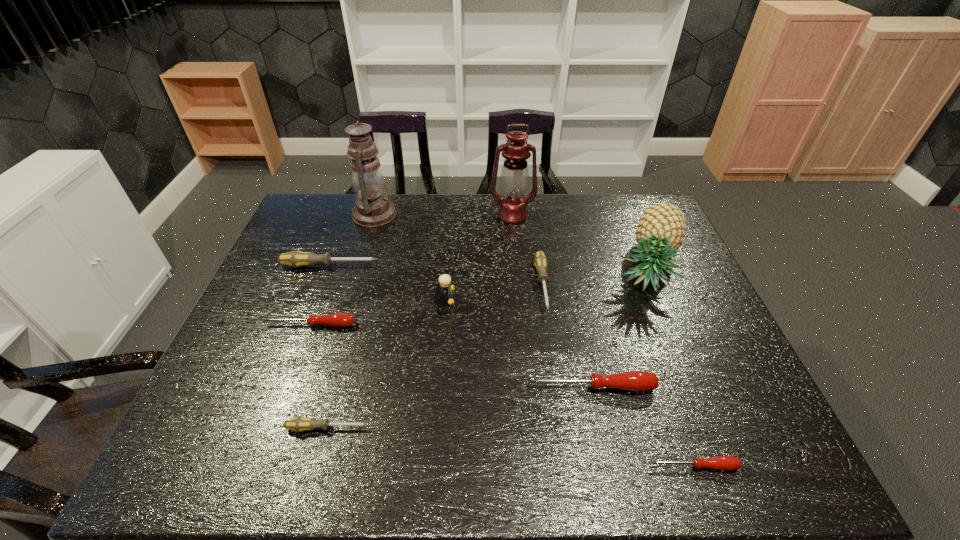
Locate an element on the screen. This screenshot has height=540, width=960. free spot located on the back of the third nearest object is located at coordinates (576, 316).

The width and height of the screenshot is (960, 540). Identify the location of vacant space located at the tip of the second smallest gray screwdriver. (559, 392).

Locate an element on the screen. The height and width of the screenshot is (540, 960). vacant area located 0.200m on the back of the seventh farthest object is located at coordinates (331, 270).

Identify the location of vacant space situated 0.250m at the tip of the nearest gray screwdriver. (484, 428).

Where is `vacant area situated 0.280m on the back of the smallest red screwdriver`? This screenshot has width=960, height=540. vacant area situated 0.280m on the back of the smallest red screwdriver is located at coordinates (653, 350).

Locate an element on the screen. The height and width of the screenshot is (540, 960). pineapple located in the far edge section of the desktop is located at coordinates (660, 231).

This screenshot has height=540, width=960. Find the location of `pineapple that is positioned at the right edge`. pineapple that is positioned at the right edge is located at coordinates (660, 231).

Image resolution: width=960 pixels, height=540 pixels. What are the coordinates of `screwdriver that is at the right edge` in the screenshot? It's located at coord(726,463).

The height and width of the screenshot is (540, 960). I want to click on object that is at the far right corner, so click(660, 231).

Where is `object positioned at the near right corner`? object positioned at the near right corner is located at coordinates (726, 463).